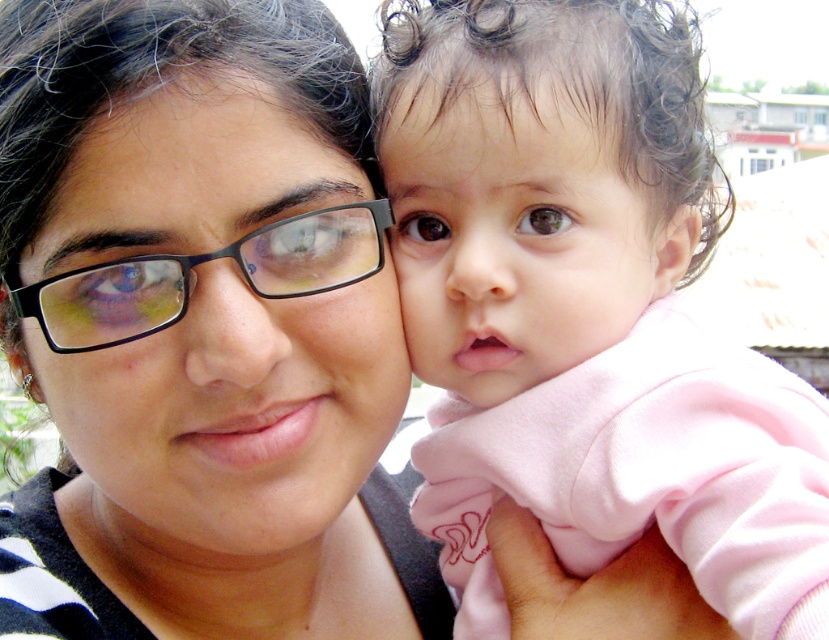
Question: Which point is farther from the camera taking this photo?

Choices:
 (A) (585, 337)
 (B) (80, 348)
 (C) (28, 273)
 (D) (571, 131)

Answer: (B)

Question: Can you confirm if matte black glasses at center is positioned above black plastic glasses at center?

Choices:
 (A) no
 (B) yes

Answer: (A)

Question: Which object appears closest to the camera in this image?

Choices:
 (A) smooth pink baby at center
 (B) matte black glasses at center

Answer: (A)

Question: Based on their relative distances, which object is nearer to the smooth pink baby at center?

Choices:
 (A) matte black glasses at center
 (B) black plastic glasses at center
 (C) pink soft fabric at center

Answer: (C)

Question: Is pink soft fabric at center above black plastic glasses at center?

Choices:
 (A) no
 (B) yes

Answer: (A)

Question: Does pink soft fabric at center appear on the left side of black plastic glasses at center?

Choices:
 (A) no
 (B) yes

Answer: (A)